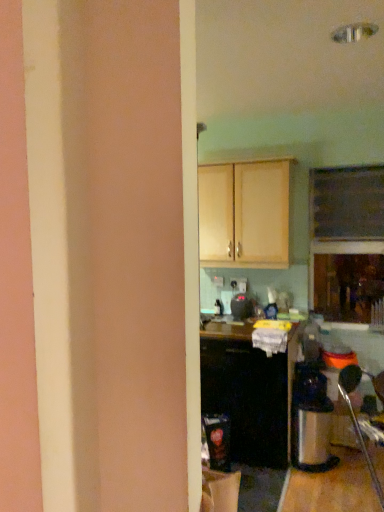
Question: Is black plastic toaster at center surrounding light wood cabinet at upper center, arranged as the 1th cabinetry when viewed from the top?

Choices:
 (A) no
 (B) yes

Answer: (A)

Question: Can you confirm if black plastic toaster at center is positioned to the right of light wood cabinet at upper center, arranged as the 1th cabinetry when viewed from the top?

Choices:
 (A) yes
 (B) no

Answer: (A)

Question: Is black plastic toaster at center smaller than light wood cabinet at upper center, which is the 2th cabinetry from bottom to top?

Choices:
 (A) yes
 (B) no

Answer: (A)

Question: Is black plastic toaster at center next to light wood cabinet at upper center, arranged as the 1th cabinetry when viewed from the top, and touching it?

Choices:
 (A) no
 (B) yes

Answer: (A)

Question: Can you confirm if black plastic toaster at center is bigger than light wood cabinet at upper center, which is the 2th cabinetry from bottom to top?

Choices:
 (A) yes
 (B) no

Answer: (B)

Question: Do you think light wood cabinet at upper center, arranged as the 1th cabinetry when viewed from the top, is within black matte cabinet at center, which is the first cabinetry in bottom-to-top order, or outside of it?

Choices:
 (A) outside
 (B) inside

Answer: (A)

Question: Relative to black matte cabinet at center, which is the first cabinetry in bottom-to-top order, is light wood cabinet at upper center, arranged as the 1th cabinetry when viewed from the top, in front or behind?

Choices:
 (A) behind
 (B) front

Answer: (A)

Question: Is light wood cabinet at upper center, which is the 2th cabinetry from bottom to top, wider or thinner than black matte cabinet at center, which is the first cabinetry in bottom-to-top order?

Choices:
 (A) wide
 (B) thin

Answer: (B)

Question: Is point (208, 265) closer or farther from the camera than point (244, 421)?

Choices:
 (A) closer
 (B) farther

Answer: (B)

Question: From a real-world perspective, is black plastic toaster at center positioned above or below light wood cabinet at upper center, which is the 2th cabinetry from bottom to top?

Choices:
 (A) below
 (B) above

Answer: (A)

Question: In the image, is black plastic toaster at center positioned in front of or behind light wood cabinet at upper center, arranged as the 1th cabinetry when viewed from the top?

Choices:
 (A) behind
 (B) front

Answer: (A)

Question: Choose the correct answer: Is black plastic toaster at center inside light wood cabinet at upper center, arranged as the 1th cabinetry when viewed from the top, or outside it?

Choices:
 (A) inside
 (B) outside

Answer: (B)

Question: Is black plastic toaster at center taller or shorter than light wood cabinet at upper center, which is the 2th cabinetry from bottom to top?

Choices:
 (A) short
 (B) tall

Answer: (A)

Question: Does point pyautogui.click(x=264, y=410) appear closer or farther from the camera than point pyautogui.click(x=223, y=181)?

Choices:
 (A) closer
 (B) farther

Answer: (A)

Question: Visually, is black matte cabinet at center, the 2th cabinetry viewed from the top, positioned to the left or to the right of light wood cabinet at upper center, which is the 2th cabinetry from bottom to top?

Choices:
 (A) right
 (B) left

Answer: (A)